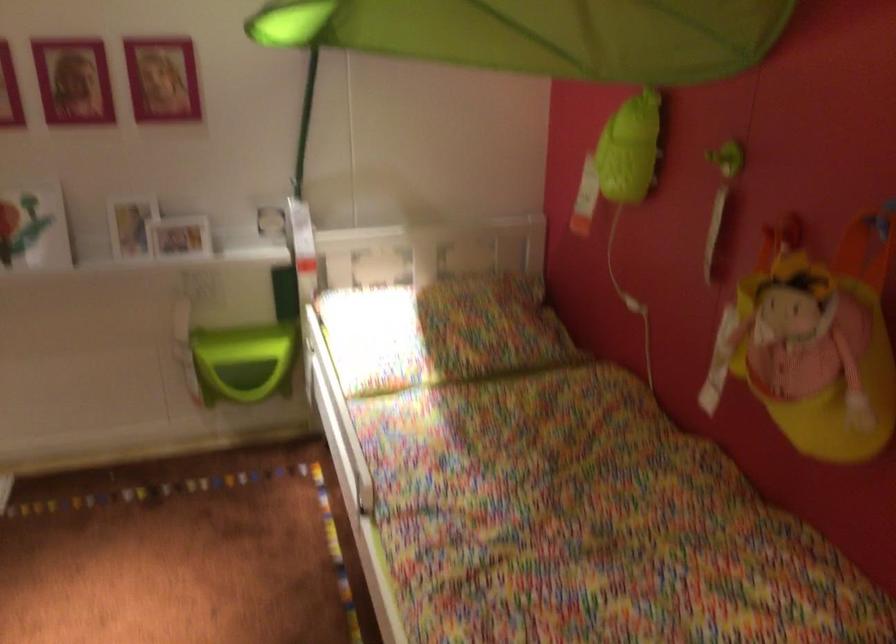
Find where to lift the stuffed doll. Please return your answer as a coordinate pair (x, y).

(814, 342)